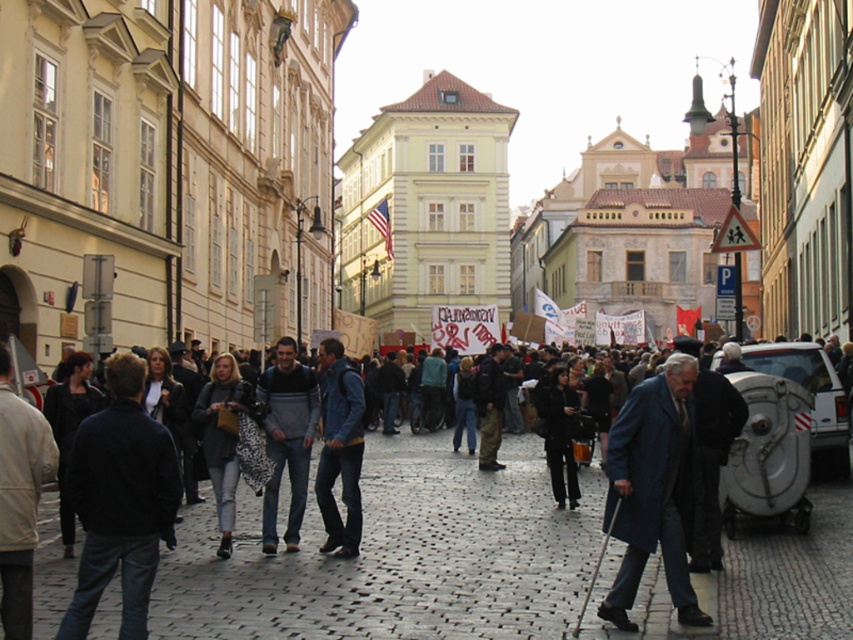
Measure the distance between light beige jacket at left and knit sweater at center.

light beige jacket at left is 36.66 feet from knit sweater at center.

Who is higher up, light beige jacket at left or knit sweater at center?

Positioned higher is light beige jacket at left.

Does point (12, 474) come farther from viewer compared to point (287, 435)?

No, (12, 474) is closer to viewer.

This screenshot has width=853, height=640. Find the location of `light beige jacket at left`. light beige jacket at left is located at coordinates pyautogui.click(x=19, y=499).

Does black matte jacket at left lie in front of blue wool coat at center?

Yes.

Between point (132, 524) and point (646, 499), which one is positioned behind?

The point (646, 499) is behind.

The height and width of the screenshot is (640, 853). What do you see at coordinates (120, 500) in the screenshot? I see `black matte jacket at left` at bounding box center [120, 500].

Where is `black matte jacket at left`? black matte jacket at left is located at coordinates (120, 500).

You are a GUI agent. You are given a task and a screenshot of the screen. Output one action in this format:
    pyautogui.click(x=<x>, y=<y>)
    Task: Click on the blue wool coat at center
    This screenshot has width=853, height=640.
    Given the screenshot: What is the action you would take?
    653,490

Locate an element on the screen. The width and height of the screenshot is (853, 640). blue wool coat at center is located at coordinates [653, 490].

At what (x,y) coordinates should I click in order to perform the action: click on blue wool coat at center. Please return your answer as a coordinate pair (x, y). Image resolution: width=853 pixels, height=640 pixels. Looking at the image, I should click on (653, 490).